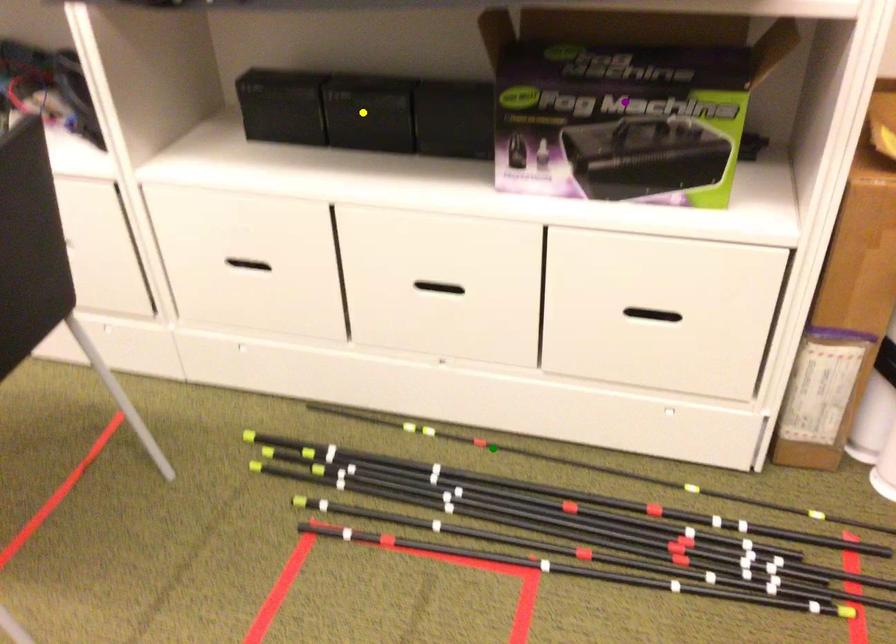
Order these from farthest to nearest:
yellow point
purple point
green point

green point < yellow point < purple point